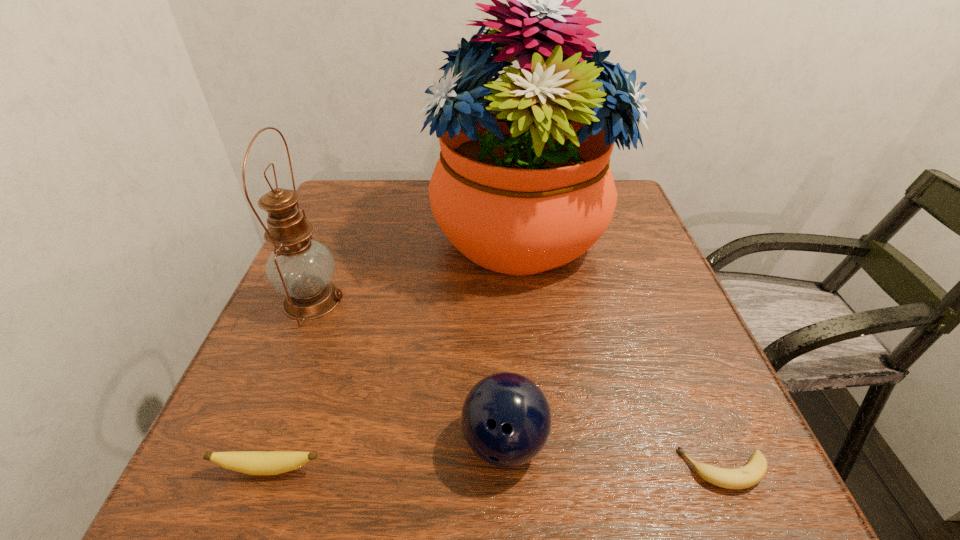
Find the location of `free space between the flower arrangement and the second shortest object`. free space between the flower arrangement and the second shortest object is located at coordinates (395, 351).

You are a GUI agent. You are given a task and a screenshot of the screen. Output one action in this format:
    pyautogui.click(x=<x>, y=<y>)
    Task: Click on the free space that is in between the oil lamp and the tallest object
    The height and width of the screenshot is (540, 960).
    Given the screenshot: What is the action you would take?
    pyautogui.click(x=417, y=267)

Locate an element on the screen. unoccupied position between the oil lamp and the third tallest object is located at coordinates (408, 371).

The width and height of the screenshot is (960, 540). In order to click on empty space between the third tallest object and the fourth tallest object in this screenshot , I will do `click(387, 455)`.

Image resolution: width=960 pixels, height=540 pixels. What are the coordinates of `free space between the shorter banana and the flower arrangement` in the screenshot? It's located at (623, 352).

At what (x,y) coordinates should I click in order to perform the action: click on object that ranks as the second closest to the tallest object. Please return your answer as a coordinate pair (x, y). Looking at the image, I should click on click(506, 419).

Choose which object is the third nearest neighbor to the oil lamp. Please provide its 2D coordinates. Your answer should be formatted as a tuple, i.e. [(x, y)], where the tuple contains the x and y coordinates of a point satisfying the conditions above.

[(506, 419)]